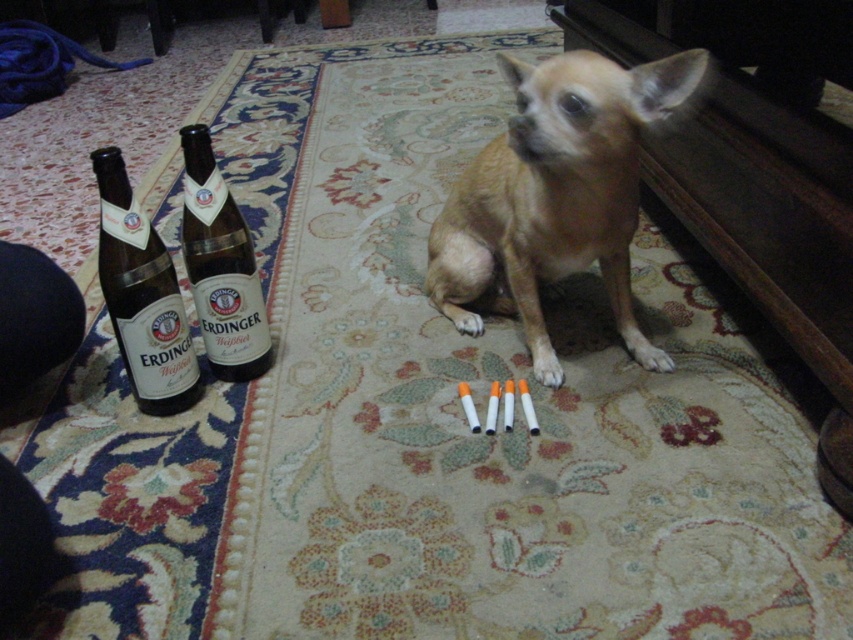
You are a photographer taking a picture of the two points on the rug where the bottles are placed. Which point, point (671, 64) or point (212, 177), is closer to you?

Point (671, 64) is closer to the viewer than point (212, 177).

You are a photographer trying to capture the light brown fur at center and the brown glass beer bottle at left in the same frame. Which object will appear larger in the photo?

The light brown fur at center will appear larger in the photo because it is closer to the viewer than the brown glass beer bottle at left.

You are a small robot with a 12 inch wide arm. You need to pick up the brown glass bottle at left from the rug without touching the light brown fur at center. Is your arm narrow enough to reach the bottle without touching the fur?

The light brown fur at center is 15.79 inches away from the brown glass bottle at left. Since your arm is only 12 inches wide, it may not be able to reach the bottle without potentially overlapping into the space between them, which is 15.79 inches. Therefore, your arm might be too wide to safely pick up the bottle without touching the fur.